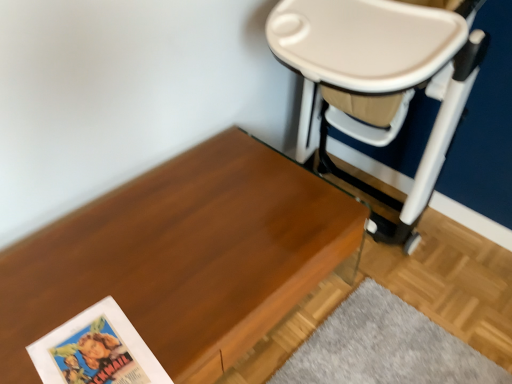
The image size is (512, 384). Find the location of `vacant space situated above matte paper paperback book at lower left (from a real-world perspective)`. vacant space situated above matte paper paperback book at lower left (from a real-world perspective) is located at coordinates (89, 350).